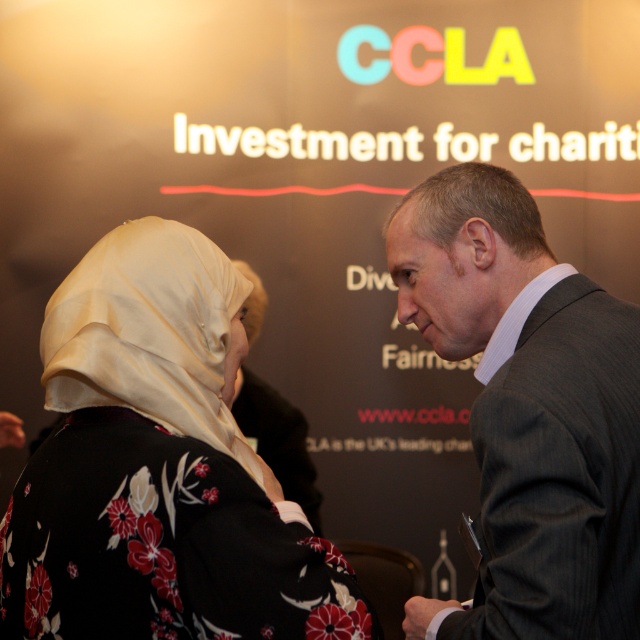
Question: Does silky beige hijab at left appear under dark gray suit at right?

Choices:
 (A) no
 (B) yes

Answer: (B)

Question: Which point is farther from the camera taking this photo?

Choices:
 (A) (477, 234)
 (B) (212, 627)

Answer: (A)

Question: Which point is closer to the camera taking this photo?

Choices:
 (A) coord(269,484)
 (B) coord(516,401)

Answer: (B)

Question: Can you confirm if silky beige hijab at left is positioned to the left of dark gray suit at right?

Choices:
 (A) yes
 (B) no

Answer: (A)

Question: Among these objects, which one is nearest to the camera?

Choices:
 (A) dark gray suit at right
 (B) silky beige hijab at left

Answer: (B)

Question: Does silky beige hijab at left appear over dark gray suit at right?

Choices:
 (A) no
 (B) yes

Answer: (A)